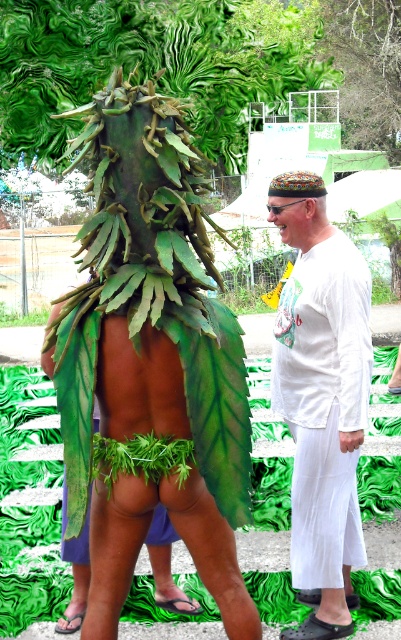
Based on the photo, is the position of white satin shirt at center less distant than that of green leafy costume at center?

Yes, it is.

Between white satin shirt at center and green leafy costume at center, which one appears on the left side from the viewer's perspective?

From the viewer's perspective, green leafy costume at center appears more on the left side.

From the picture: Who is more forward, (326, 324) or (44, 317)?

Point (326, 324) is in front.

I want to click on white satin shirt at center, so click(322, 397).

Is white satin shirt at center smaller than multicolored woven hat at center?

Actually, white satin shirt at center might be larger than multicolored woven hat at center.

The width and height of the screenshot is (401, 640). Find the location of `white satin shirt at center`. white satin shirt at center is located at coordinates (322, 397).

Looking at this image, can you confirm if multicolored woven hat at center is smaller than green leafy costume at center?

Yes, multicolored woven hat at center is smaller than green leafy costume at center.

Is multicolored woven hat at center above green leafy costume at center?

Indeed, multicolored woven hat at center is positioned over green leafy costume at center.

In order to click on multicolored woven hat at center in this screenshot , I will do `click(299, 209)`.

The height and width of the screenshot is (640, 401). I want to click on multicolored woven hat at center, so click(299, 209).